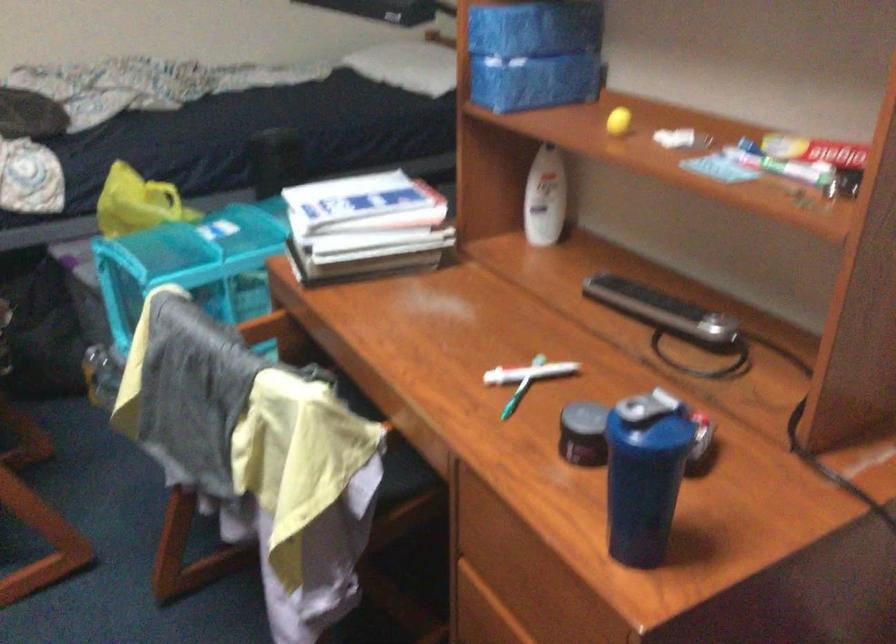
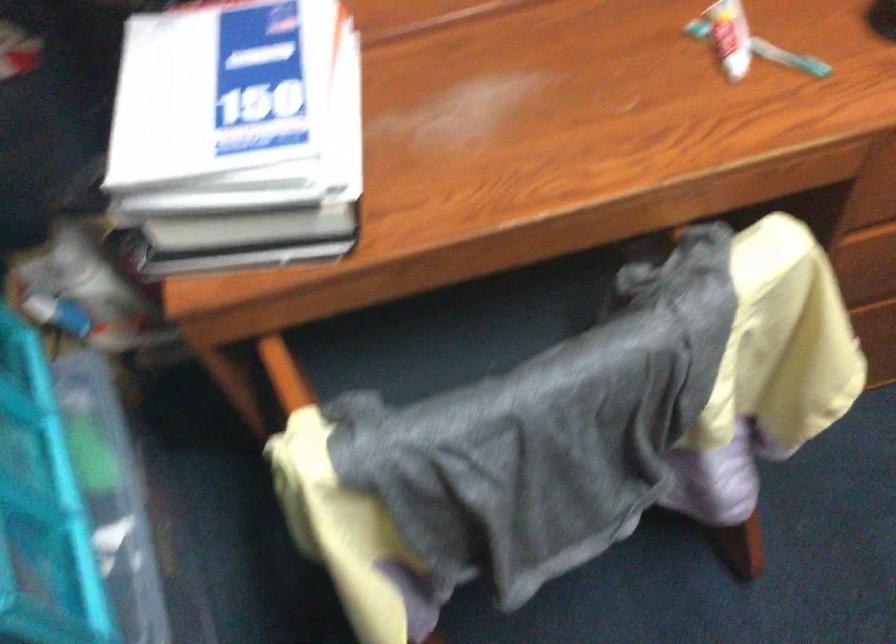
The point at (317,205) is marked in the first image. Where is the corresponding point in the second image?

(237, 128)